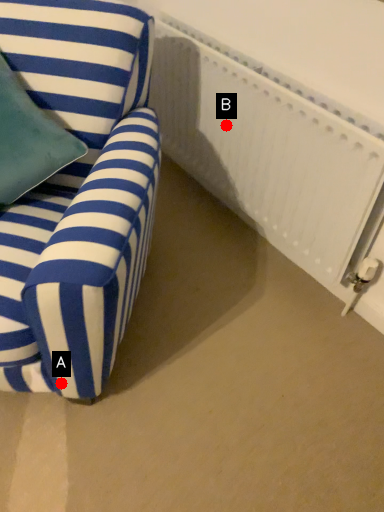
Question: Two points are circled on the image, labeled by A and B beside each circle. Which point is closer to the camera?

Choices:
 (A) A is closer
 (B) B is closer

Answer: (A)